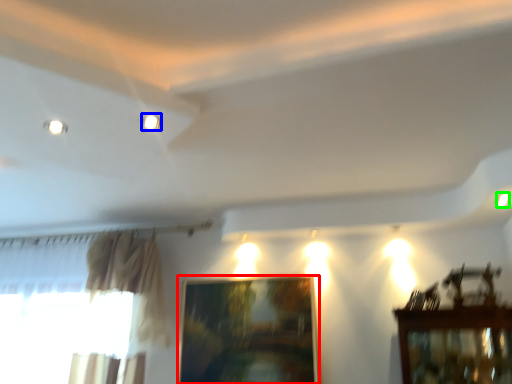
Question: Considering the real-world distances, which object is closest to picture frame (highlighted by a red box)? lighting (highlighted by a blue box) or light (highlighted by a green box).

Choices:
 (A) lighting
 (B) light

Answer: (B)